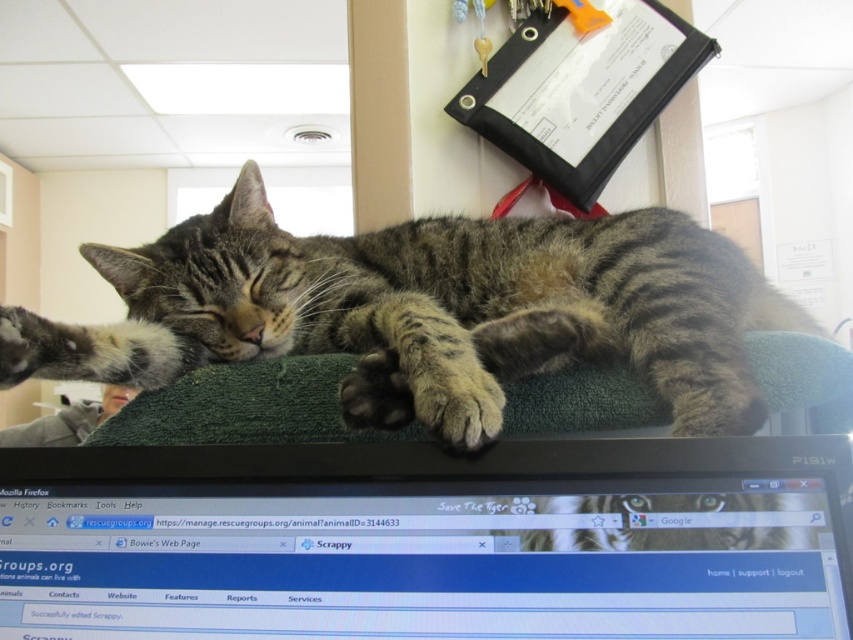
Question: Which object is closer to the camera taking this photo?

Choices:
 (A) shiny black monitor at center
 (B) tabby fur cat at center

Answer: (A)

Question: Is shiny black monitor at center thinner than tabby fur cat at center?

Choices:
 (A) yes
 (B) no

Answer: (A)

Question: Is shiny black monitor at center closer to the viewer compared to tabby fur cat at center?

Choices:
 (A) yes
 (B) no

Answer: (A)

Question: Does shiny black monitor at center have a greater width compared to tabby fur cat at center?

Choices:
 (A) no
 (B) yes

Answer: (A)